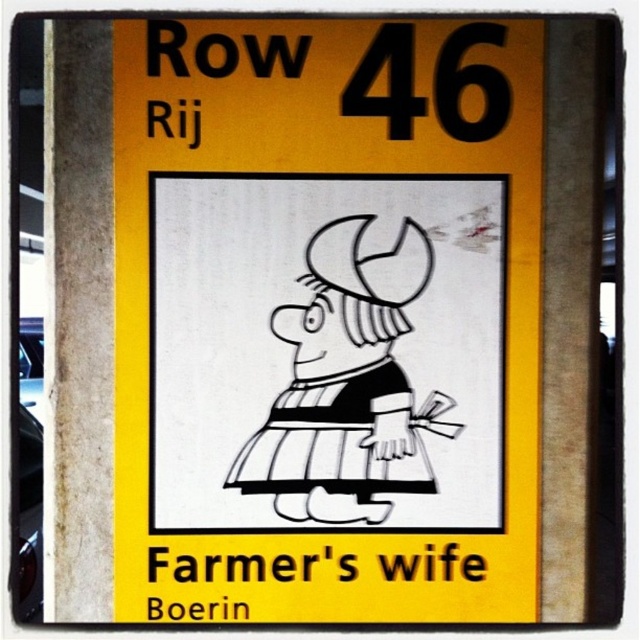
Question: Which of the following is the farthest from the observer?

Choices:
 (A) (371, 321)
 (B) (385, 212)

Answer: (A)

Question: Does yellow paper sign at center have a larger size compared to black line drawing of farmer's wife at center?

Choices:
 (A) yes
 (B) no

Answer: (A)

Question: Which of the following is the farthest from the observer?

Choices:
 (A) (340, 422)
 (B) (481, 388)

Answer: (B)

Question: Does yellow paper sign at center have a greater width compared to black line drawing of farmer's wife at center?

Choices:
 (A) yes
 (B) no

Answer: (A)

Question: Does yellow paper sign at center lie behind black line drawing of farmer's wife at center?

Choices:
 (A) yes
 (B) no

Answer: (B)

Question: Which of the following is the closest to the observer?

Choices:
 (A) (360, 451)
 (B) (189, 401)

Answer: (B)